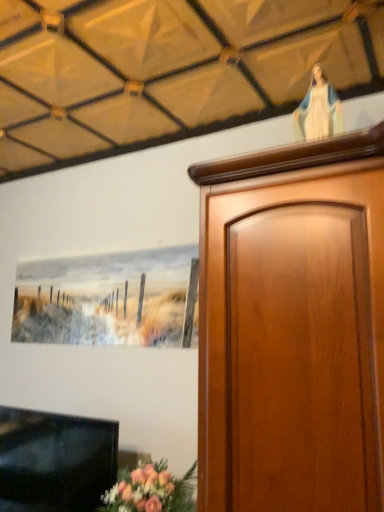
Question: In terms of height, does white glossy statue at upper right look taller or shorter compared to black glossy tv at lower left?

Choices:
 (A) tall
 (B) short

Answer: (B)

Question: In terms of size, does white glossy statue at upper right appear bigger or smaller than black glossy tv at lower left?

Choices:
 (A) small
 (B) big

Answer: (A)

Question: From the image's perspective, is white glossy statue at upper right located above or below black glossy tv at lower left?

Choices:
 (A) below
 (B) above

Answer: (B)

Question: From the image's perspective, is black glossy tv at lower left positioned above or below white glossy statue at upper right?

Choices:
 (A) below
 (B) above

Answer: (A)

Question: Would you say black glossy tv at lower left is inside or outside white glossy statue at upper right?

Choices:
 (A) outside
 (B) inside

Answer: (A)

Question: Relative to white glossy statue at upper right, is black glossy tv at lower left in front or behind?

Choices:
 (A) front
 (B) behind

Answer: (B)

Question: From a real-world perspective, is black glossy tv at lower left positioned above or below white glossy statue at upper right?

Choices:
 (A) above
 (B) below

Answer: (B)